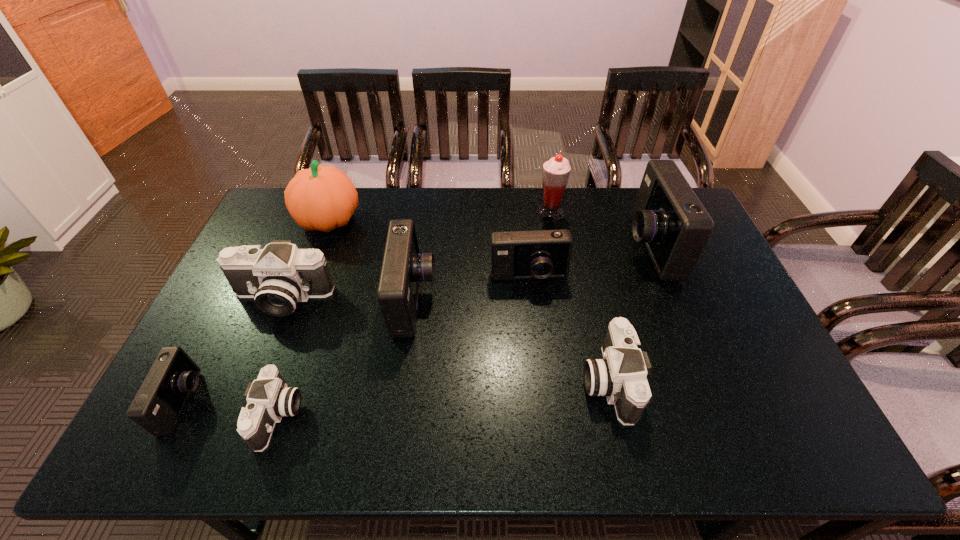
This screenshot has width=960, height=540. In order to click on free space located on the left of the second smallest black camera in this screenshot , I will do `click(499, 381)`.

Locate an element on the screen. The width and height of the screenshot is (960, 540). vacant area situated on the front-facing side of the leftmost blue camera is located at coordinates (282, 403).

Image resolution: width=960 pixels, height=540 pixels. Find the location of `vacant space located 0.240m on the right of the smallest black camera`. vacant space located 0.240m on the right of the smallest black camera is located at coordinates (399, 416).

This screenshot has height=540, width=960. In order to click on smoothie present at the far edge in this screenshot , I will do point(556,171).

In order to click on pumpkin located in the far edge section of the desktop in this screenshot , I will do `click(321, 198)`.

Where is `camera located in the far edge section of the desktop`? Image resolution: width=960 pixels, height=540 pixels. camera located in the far edge section of the desktop is located at coordinates (669, 218).

The width and height of the screenshot is (960, 540). What are the coordinates of `pumpkin located at the left edge` in the screenshot? It's located at (321, 198).

This screenshot has width=960, height=540. Identify the location of object that is at the right edge. (669, 218).

Locate an element on the screen. Image resolution: width=960 pixels, height=540 pixels. object situated at the far left corner is located at coordinates (321, 198).

Find the location of a particular element. The height and width of the screenshot is (540, 960). object that is at the near left corner is located at coordinates (159, 402).